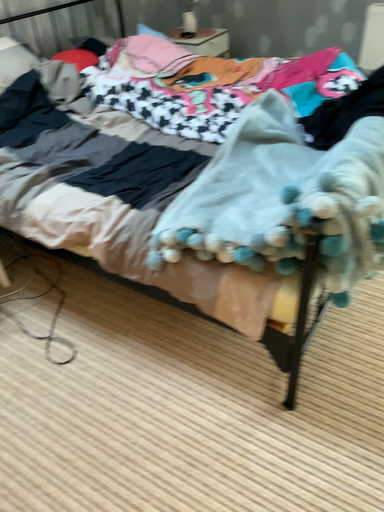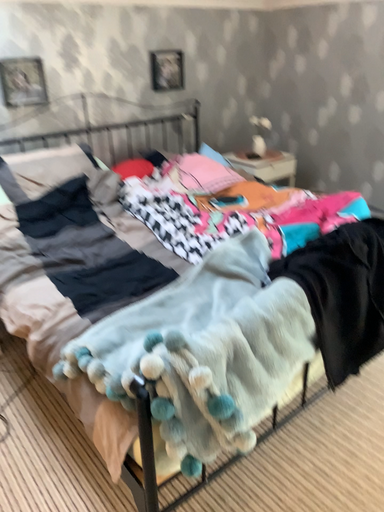
Question: Which way did the camera rotate in the video?

Choices:
 (A) rotated upward
 (B) rotated downward

Answer: (A)